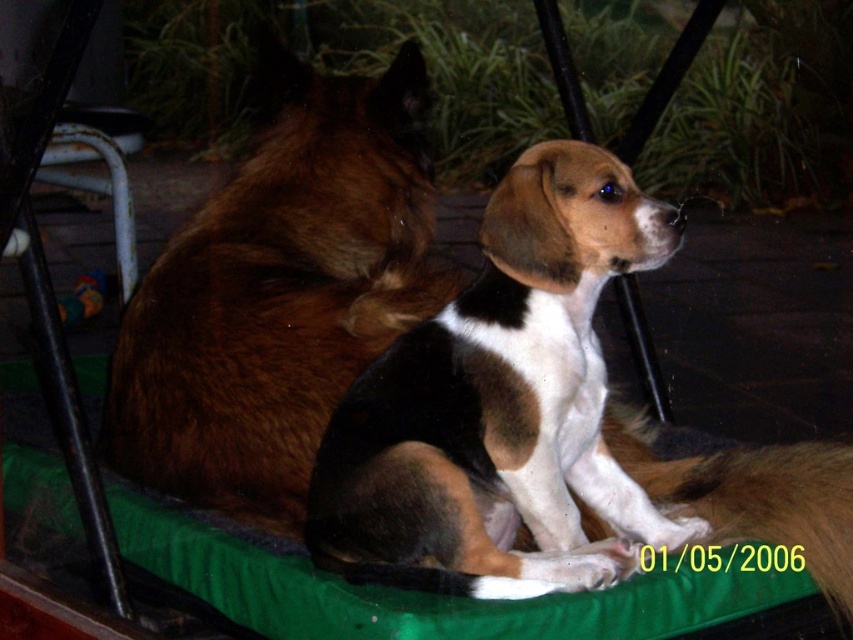
Question: Observing the image, what is the correct spatial positioning of tri-colored fur dog at center in reference to brown furry dog at center?

Choices:
 (A) right
 (B) left

Answer: (A)

Question: Which point is farther to the camera?

Choices:
 (A) brown furry dog at center
 (B) tri-colored fur dog at center

Answer: (A)

Question: Can you confirm if tri-colored fur dog at center is bigger than brown furry dog at center?

Choices:
 (A) no
 (B) yes

Answer: (A)

Question: Does tri-colored fur dog at center appear over brown furry dog at center?

Choices:
 (A) yes
 (B) no

Answer: (B)